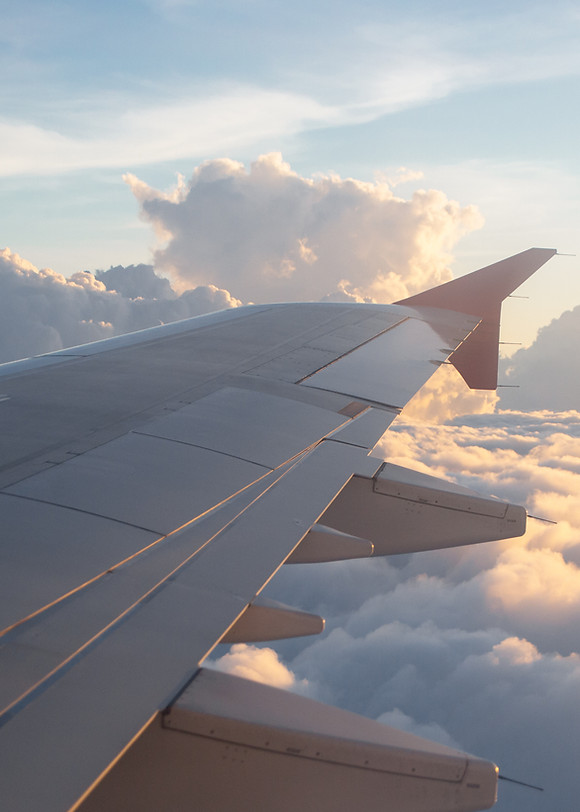
Where is `panel`? panel is located at coordinates (158, 512).